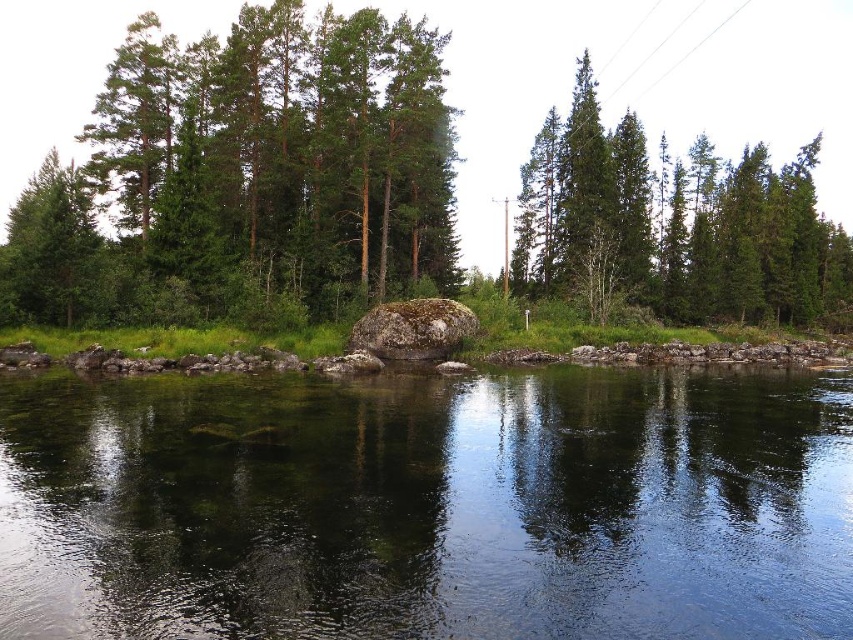
Consider the image. You are a hiker trying to navigate through the landscape. You see the green mossy rock at center and the green matte tree at center. Which object is located to the left when facing the scene?

The green mossy rock at center is positioned on the left side of the green matte tree at center, so it is located to the left when facing the scene.

You are a drone operator trying to capture a photo of the clear water at center. The drone is currently at coordinates point A. To ensure the water is in the center of the photo, should you adjust the drone to move north or south? Please provide your answer based on the coordinates provided in the scene description.

The clear water at center is located at coordinates point A at position (427, 506). Since the y coordinate is 0.502, which is slightly above the center point of 0.5, the drone should move slightly south to ensure the water is centered in the photo.